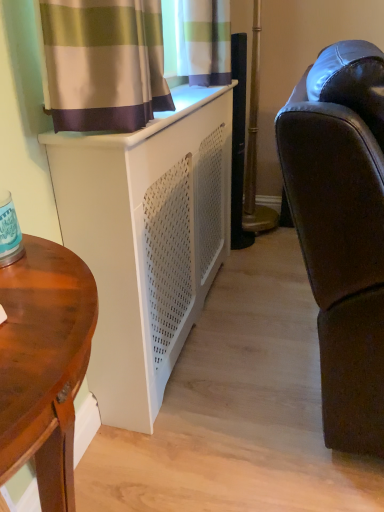
Question: Can you confirm if wooden desk at left is thinner than matte black leather couch at right?

Choices:
 (A) no
 (B) yes

Answer: (B)

Question: Does wooden desk at left come behind matte black leather couch at right?

Choices:
 (A) yes
 (B) no

Answer: (B)

Question: From a real-world perspective, is wooden desk at left on matte black leather couch at right?

Choices:
 (A) yes
 (B) no

Answer: (B)

Question: Is wooden desk at left oriented towards matte black leather couch at right?

Choices:
 (A) yes
 (B) no

Answer: (B)

Question: Is wooden desk at left in contact with matte black leather couch at right?

Choices:
 (A) no
 (B) yes

Answer: (A)

Question: From the image's perspective, does wooden desk at left appear lower than matte black leather couch at right?

Choices:
 (A) yes
 (B) no

Answer: (A)

Question: Does matte black leather couch at right have a lesser width compared to white matte cabinet at lower left?

Choices:
 (A) yes
 (B) no

Answer: (B)

Question: Is there a large distance between matte black leather couch at right and white matte cabinet at lower left?

Choices:
 (A) no
 (B) yes

Answer: (A)

Question: Is matte black leather couch at right in front of white matte cabinet at lower left?

Choices:
 (A) yes
 (B) no

Answer: (A)

Question: Is white matte cabinet at lower left located within matte black leather couch at right?

Choices:
 (A) no
 (B) yes

Answer: (A)

Question: Is white matte cabinet at lower left at the back of matte black leather couch at right?

Choices:
 (A) no
 (B) yes

Answer: (B)

Question: Is matte black leather couch at right shorter than white matte cabinet at lower left?

Choices:
 (A) no
 (B) yes

Answer: (A)

Question: Is there a large distance between wooden desk at left and white matte cabinet at lower left?

Choices:
 (A) yes
 (B) no

Answer: (B)